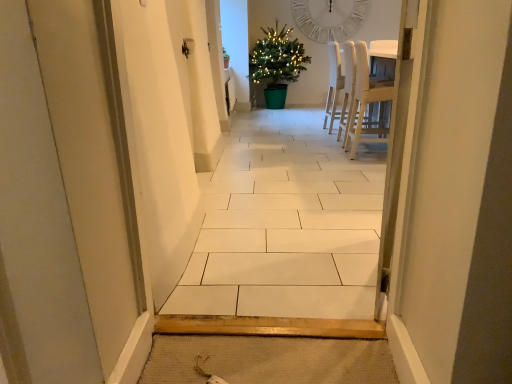
Question: Can you confirm if white matte clock at upper center is taller than green plastic potted plant at center?

Choices:
 (A) yes
 (B) no

Answer: (B)

Question: Is white matte clock at upper center to the left of green plastic potted plant at center from the viewer's perspective?

Choices:
 (A) yes
 (B) no

Answer: (B)

Question: Is white matte clock at upper center facing away from green plastic potted plant at center?

Choices:
 (A) no
 (B) yes

Answer: (A)

Question: From the image's perspective, is white matte clock at upper center beneath green plastic potted plant at center?

Choices:
 (A) no
 (B) yes

Answer: (A)

Question: Does white matte clock at upper center contain green plastic potted plant at center?

Choices:
 (A) no
 (B) yes

Answer: (A)

Question: Is light wood chair at right, which appears as the first chair when viewed from the front, taller or shorter than white wood chair at center, which is counted as the second chair, starting from the front?

Choices:
 (A) short
 (B) tall

Answer: (A)

Question: Is point (371, 87) positioned closer to the camera than point (354, 76)?

Choices:
 (A) farther
 (B) closer

Answer: (B)

Question: Is light wood chair at right, positioned as the second chair in back-to-front order, to the left or to the right of white wood chair at center, which is counted as the second chair, starting from the front, in the image?

Choices:
 (A) right
 (B) left

Answer: (A)

Question: From the image's perspective, is light wood chair at right, which appears as the first chair when viewed from the front, positioned above or below white wood chair at center, which is the first chair from back to front?

Choices:
 (A) below
 (B) above

Answer: (A)

Question: In terms of height, does white tile floor at center look taller or shorter compared to light wood chair at right, positioned as the second chair in back-to-front order?

Choices:
 (A) short
 (B) tall

Answer: (B)

Question: Based on their sizes in the image, would you say white tile floor at center is bigger or smaller than light wood chair at right, positioned as the second chair in back-to-front order?

Choices:
 (A) big
 (B) small

Answer: (B)

Question: From the image's perspective, relative to light wood chair at right, which appears as the first chair when viewed from the front, is white tile floor at center above or below?

Choices:
 (A) above
 (B) below

Answer: (B)

Question: Relative to light wood chair at right, which appears as the first chair when viewed from the front, is white tile floor at center in front or behind?

Choices:
 (A) front
 (B) behind

Answer: (A)

Question: In the image, is white wood chair at center, which is the first chair from back to front, positioned in front of or behind white matte clock at upper center?

Choices:
 (A) behind
 (B) front

Answer: (B)

Question: From the image's perspective, is white wood chair at center, which is counted as the second chair, starting from the front, above or below white matte clock at upper center?

Choices:
 (A) above
 (B) below

Answer: (B)